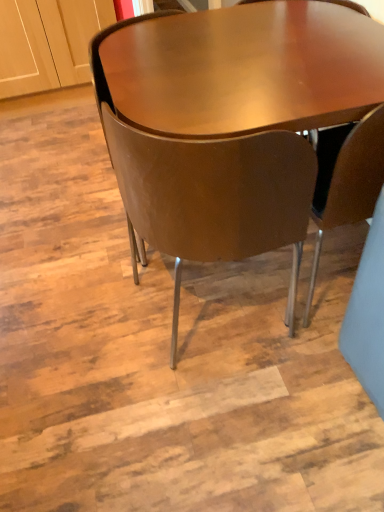
Where is `free space in front of brown leather chair at center, the 2th chair viewed from the right`? Image resolution: width=384 pixels, height=512 pixels. free space in front of brown leather chair at center, the 2th chair viewed from the right is located at coordinates (234, 416).